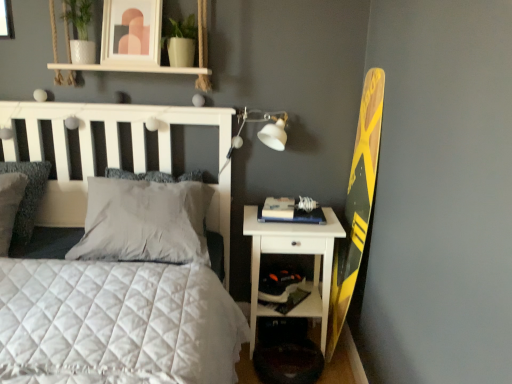
Question: Is white soft pillow at center, positioned as the first pillow in right-to-left order, not near matte white picture frame at upper center?

Choices:
 (A) no
 (B) yes

Answer: (A)

Question: From the image's perspective, would you say white soft pillow at center, the 3th pillow in the left-to-right sequence, is positioned over matte white picture frame at upper center?

Choices:
 (A) no
 (B) yes

Answer: (A)

Question: Does white soft pillow at center, the 3th pillow in the left-to-right sequence, have a greater height compared to matte white picture frame at upper center?

Choices:
 (A) yes
 (B) no

Answer: (B)

Question: Considering the relative positions of white soft pillow at center, positioned as the first pillow in right-to-left order, and matte white picture frame at upper center in the image provided, is white soft pillow at center, positioned as the first pillow in right-to-left order, to the left of matte white picture frame at upper center from the viewer's perspective?

Choices:
 (A) yes
 (B) no

Answer: (B)

Question: Does white soft pillow at center, the 3th pillow in the left-to-right sequence, come behind matte white picture frame at upper center?

Choices:
 (A) no
 (B) yes

Answer: (A)

Question: Based on their positions, is matte white picture frame at upper center located to the left or right of white matte table lamp at upper right?

Choices:
 (A) right
 (B) left

Answer: (B)

Question: Is matte white picture frame at upper center bigger or smaller than white matte table lamp at upper right?

Choices:
 (A) big
 (B) small

Answer: (B)

Question: Is matte white picture frame at upper center in front of or behind white matte table lamp at upper right in the image?

Choices:
 (A) front
 (B) behind

Answer: (A)

Question: Is matte white picture frame at upper center inside or outside of white matte table lamp at upper right?

Choices:
 (A) outside
 (B) inside

Answer: (A)

Question: In the image, is hardcover book at right positioned in front of or behind white soft pillow at center, positioned as the first pillow in right-to-left order?

Choices:
 (A) front
 (B) behind

Answer: (B)

Question: Based on their positions, is hardcover book at right located to the left or right of white soft pillow at center, positioned as the first pillow in right-to-left order?

Choices:
 (A) right
 (B) left

Answer: (A)

Question: Considering the positions of hardcover book at right and white soft pillow at center, positioned as the first pillow in right-to-left order, in the image, is hardcover book at right taller or shorter than white soft pillow at center, positioned as the first pillow in right-to-left order,?

Choices:
 (A) short
 (B) tall

Answer: (A)

Question: Is hardcover book at right situated inside white soft pillow at center, the 3th pillow in the left-to-right sequence, or outside?

Choices:
 (A) outside
 (B) inside

Answer: (A)

Question: Based on their positions, is white plastic shelf at lower right located to the left or right of matte white picture frame at upper center?

Choices:
 (A) right
 (B) left

Answer: (A)

Question: Looking at their shapes, would you say white plastic shelf at lower right is wider or thinner than matte white picture frame at upper center?

Choices:
 (A) thin
 (B) wide

Answer: (B)